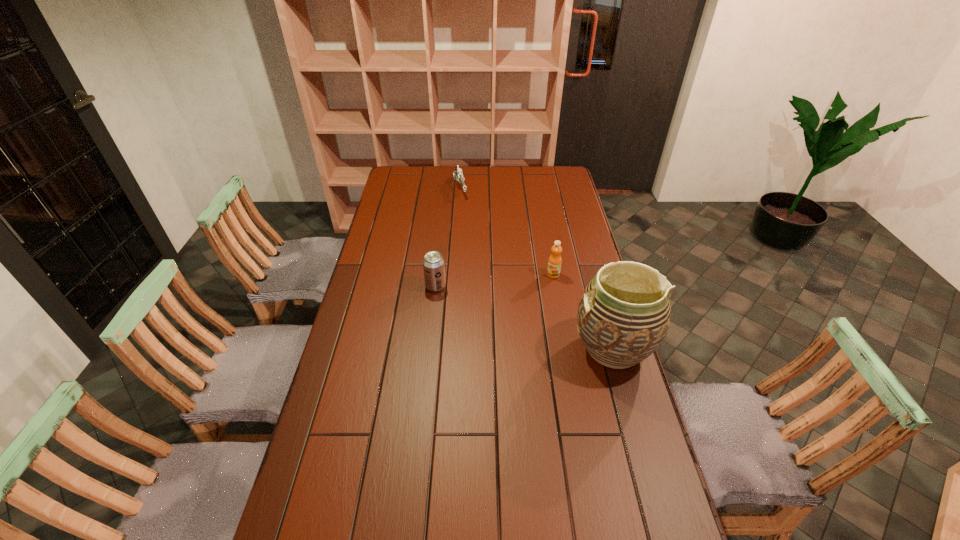
The image size is (960, 540). I want to click on vacant space on the desktop that is between the beer can and the nearest object and is positioned on the front label of the orange juice, so click(x=513, y=313).

At what (x,y) coordinates should I click in order to perform the action: click on vacant space on the desktop that is between the beer can and the nearest object and is positioned aimed along the barrel of the shortest object. Please return your answer as a coordinate pair (x, y). Looking at the image, I should click on tap(506, 310).